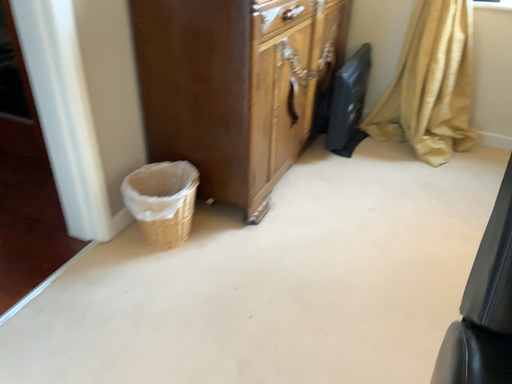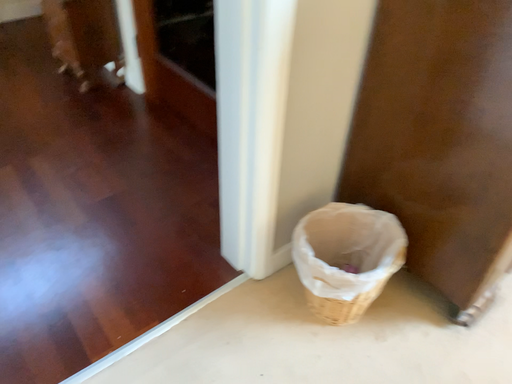
Question: Which way did the camera rotate in the video?

Choices:
 (A) rotated left
 (B) rotated right

Answer: (A)